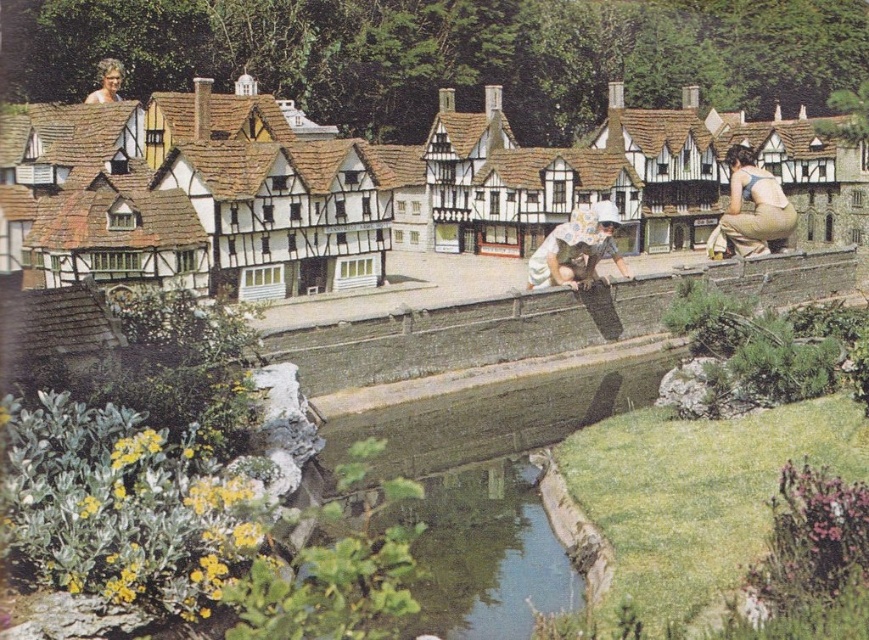
Question: Does light brown fabric overalls at right appear on the right side of floral fabric dress at center?

Choices:
 (A) no
 (B) yes

Answer: (B)

Question: Can you confirm if green concrete waterway at lower center is positioned to the left of light brown fabric overalls at right?

Choices:
 (A) yes
 (B) no

Answer: (A)

Question: Which object is positioned closest to the blonde hair at upper left?

Choices:
 (A) green concrete waterway at lower center
 (B) light brown fabric overalls at right
 (C) floral fabric dress at center

Answer: (C)

Question: Can you confirm if green concrete waterway at lower center is bigger than floral fabric dress at center?

Choices:
 (A) yes
 (B) no

Answer: (A)

Question: Which of the following is the closest to the observer?

Choices:
 (A) (535, 280)
 (B) (488, 520)
 (C) (751, 244)

Answer: (B)

Question: Which object is the closest to the light brown fabric overalls at right?

Choices:
 (A) blonde hair at upper left
 (B) green concrete waterway at lower center

Answer: (B)